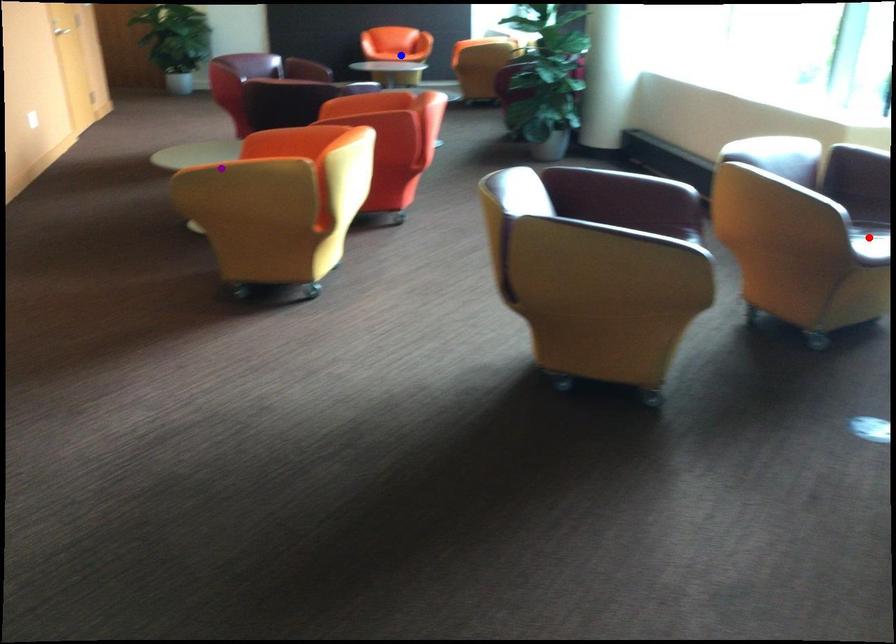
Order these from nearest to farthest:
blue point | red point | purple point

blue point < purple point < red point